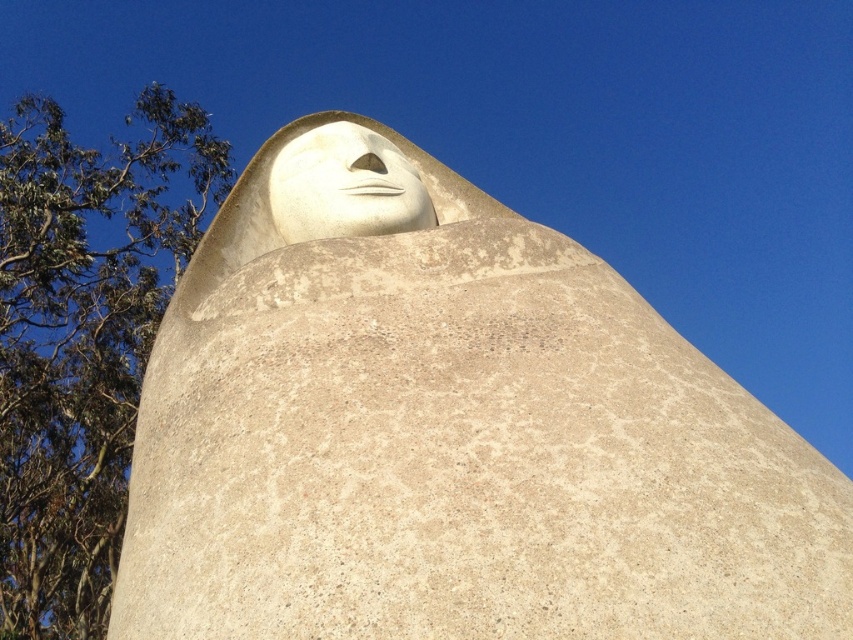
You are standing in front of the sculpture and want to touch both the white stone face at upper center and the matte gray nose at center. Which one would you need to reach higher to touch?

The matte gray nose at center is located above the white stone face at upper center, so you would need to reach higher to touch the matte gray nose at center.

You are standing in front of the sculpture and want to take a photo that includes both the green leafy tree at upper left and the sculpture. The camera you have can only focus on objects within 100 meters. Will both objects be in focus?

The green leafy tree at upper left is 128.67 meters from camera, which is beyond the camera focus range of 100 meters. Therefore, the tree will be out of focus while the sculpture is in focus, so both cannot be in focus at the same time.

You are standing in front of the sculpture and want to place a small flag at point (117, 496) and another flag at point (374, 198). Which flag will be closer to you?

The flag at point (374, 198) will be closer to you because point (117, 496) is behind point (374, 198).